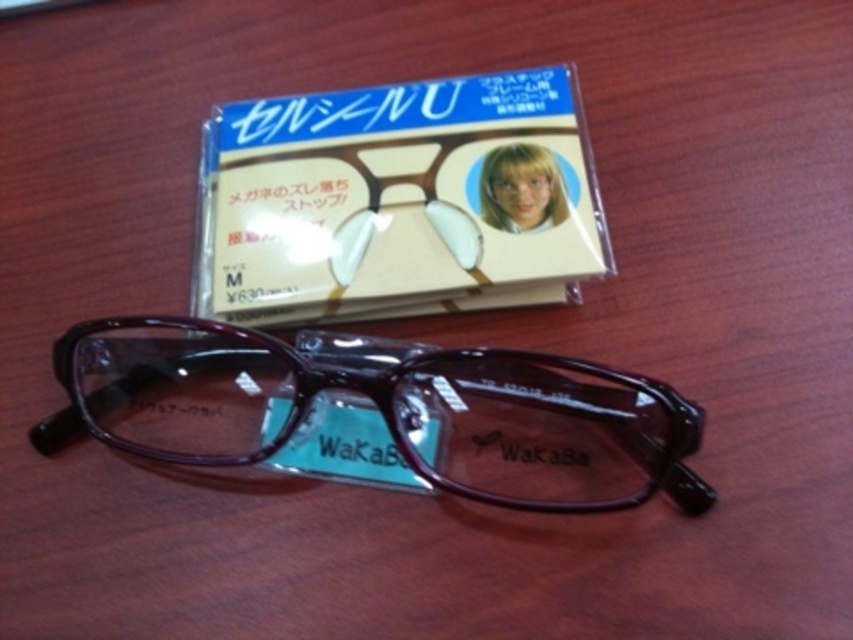
You are organizing items on a desk and need to place both the clear plastic case at upper center and the shiny brown glasses at center. If you want to stack them vertically, which one should go at the bottom to ensure stability?

The clear plastic case at upper center is much taller than the shiny brown glasses at center, so placing the clear plastic case at upper center at the bottom would provide a stable base for stacking.

You are organizing items on a desk and need to place the clear plastic case at upper center and the shiny brown glasses at center. If you have a ruler, how far apart should you position them to match the image?

You should position the clear plastic case at upper center and the shiny brown glasses at center 22.15 centimeters apart to match the image.

You are taking a photo of the glasses and the packaged product. You want to focus on the glasses first. Which point should you focus on first, point at point coordinates (370, 198) or point at point coordinates (651, 442)?

You should focus on point at point coordinates (370, 198) first because it is closer to the camera than point at point coordinates (651, 442).